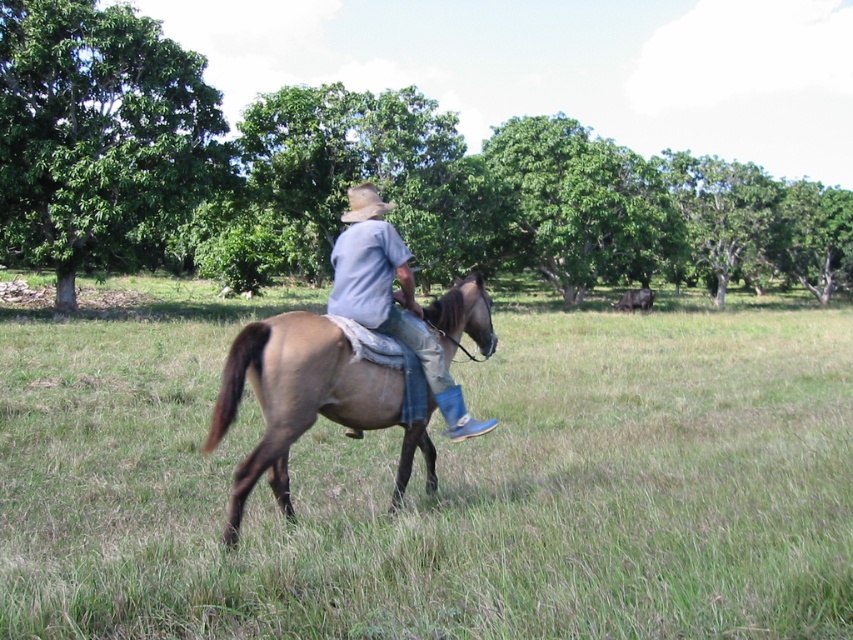
You are standing at the origin point in the image. The brown matte suede horse at center is located at point [296,396]. If you want to move towards the horse, in which direction should you move?

The brown matte suede horse at center is located at point [296,396], so you should move towards the center of the image to reach it.

You are standing at point (368, 193) and want to walk to the person riding the horse in the grassy field. Which direction should you move relative to point (622, 627)?

You should move towards point (622, 627) because it is in front of point (368, 193), so moving towards it will lead you closer to the person riding the horse.